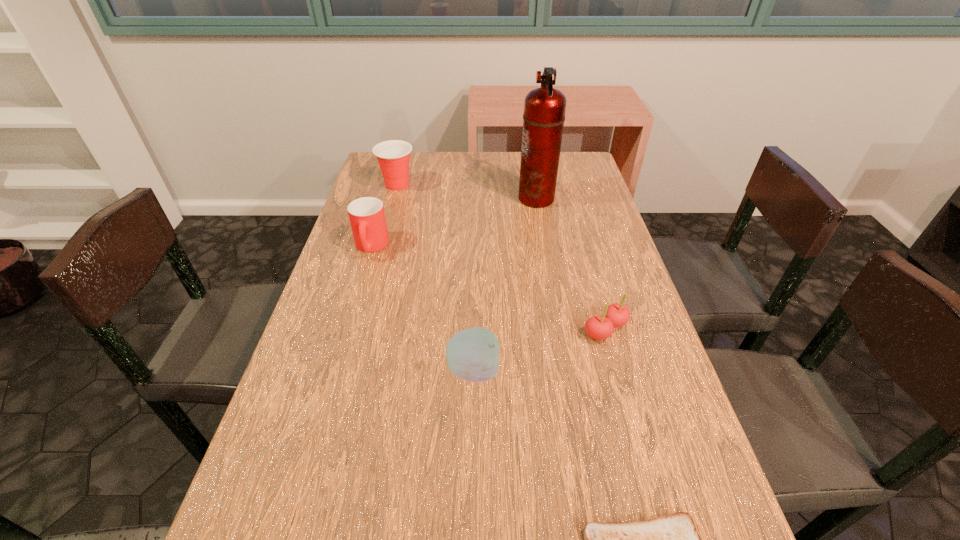
Image resolution: width=960 pixels, height=540 pixels. I want to click on free spot at the right edge of the desktop, so click(582, 209).

Where is `vacant space at the far left corner of the desktop`? This screenshot has height=540, width=960. vacant space at the far left corner of the desktop is located at coordinates (375, 185).

This screenshot has width=960, height=540. What are the coordinates of `free space between the apple and the fire extinguisher` in the screenshot? It's located at (505, 285).

What are the coordinates of `empty location between the farther cup and the apple` in the screenshot? It's located at (435, 278).

At what (x,y) coordinates should I click in order to perform the action: click on free space between the farther cup and the fire extinguisher. Please return your answer as a coordinate pair (x, y). The height and width of the screenshot is (540, 960). Looking at the image, I should click on (467, 192).

You are a GUI agent. You are given a task and a screenshot of the screen. Output one action in this format:
    pyautogui.click(x=<x>, y=<y>)
    Task: Click on the empty location between the fourth nearest object and the tallest object
    
    Given the screenshot: What is the action you would take?
    pyautogui.click(x=454, y=222)

Identify the location of free space that is in between the farther cup and the apple. This screenshot has height=540, width=960. coord(435,278).

This screenshot has height=540, width=960. Identify the location of empty space that is in between the cherry and the nearer cup. (489, 288).

Select which object is the fourth closest to the fire extinguisher. Please provide its 2D coordinates. Your answer should be formatted as a tuple, i.e. [(x, y)], where the tuple contains the x and y coordinates of a point satisfying the conditions above.

[(472, 354)]

Identify the location of object that can be found as the closest to the farther cup. This screenshot has width=960, height=540. (367, 218).